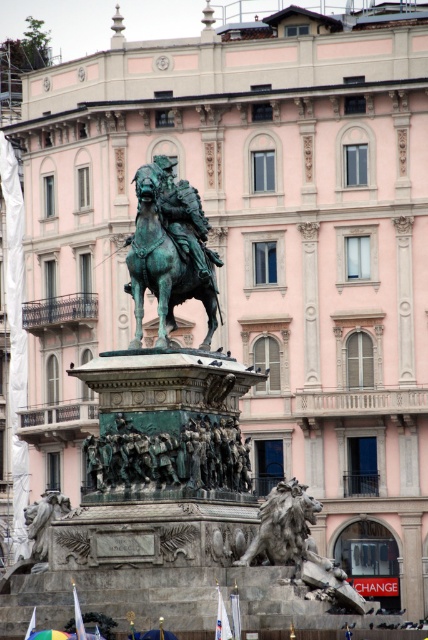
You are an art student standing in front of the building. You want to sketch both the bronze statue at center and the gray stone lion at center. Which one should you focus on first if you want to draw them in the order they appear from your current position?

You should focus on the bronze statue at center first because the gray stone lion at center is behind it, making the bronze statue closer to your current position.